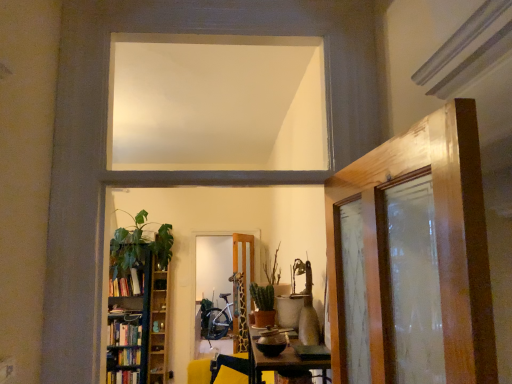
Question: From the image's perspective, is yellow fabric swivel chair at center over green matte plant at center, the 2th plant viewed from the front?

Choices:
 (A) yes
 (B) no

Answer: (B)

Question: Is yellow fabric swivel chair at center wider than green matte plant at center, the 1th plant from the back?

Choices:
 (A) no
 (B) yes

Answer: (A)

Question: Is yellow fabric swivel chair at center shorter than green matte plant at center, the 2th plant viewed from the front?

Choices:
 (A) no
 (B) yes

Answer: (B)

Question: Is yellow fabric swivel chair at center positioned beyond the bounds of green matte plant at center, the 2th plant viewed from the front?

Choices:
 (A) yes
 (B) no

Answer: (A)

Question: Does yellow fabric swivel chair at center have a smaller size compared to green matte plant at center, the 1th plant from the back?

Choices:
 (A) no
 (B) yes

Answer: (A)

Question: Is yellow fabric swivel chair at center in front of or behind green leafy plant at left in the image?

Choices:
 (A) behind
 (B) front

Answer: (B)

Question: Based on their sizes in the image, would you say yellow fabric swivel chair at center is bigger or smaller than green leafy plant at left?

Choices:
 (A) big
 (B) small

Answer: (B)

Question: From a real-world perspective, is yellow fabric swivel chair at center positioned above or below green leafy plant at left?

Choices:
 (A) above
 (B) below

Answer: (B)

Question: Considering the relative positions of yellow fabric swivel chair at center and green leafy plant at left in the image provided, is yellow fabric swivel chair at center to the left or to the right of green leafy plant at left?

Choices:
 (A) left
 (B) right

Answer: (B)

Question: Relative to green matte plant at center, the 2th plant viewed from the front, is white matte window at upper center in front or behind?

Choices:
 (A) behind
 (B) front

Answer: (B)

Question: From a real-world perspective, is white matte window at upper center physically located above or below green matte plant at center, the 1th plant from the back?

Choices:
 (A) above
 (B) below

Answer: (A)

Question: Is point (323, 94) positioned closer to the camera than point (261, 309)?

Choices:
 (A) closer
 (B) farther

Answer: (A)

Question: In terms of height, does white matte window at upper center look taller or shorter compared to green matte plant at center, the 2th plant viewed from the front?

Choices:
 (A) tall
 (B) short

Answer: (B)

Question: Is green matte plant at center, the 1th plant from the back, taller or shorter than hardcover books at left?

Choices:
 (A) tall
 (B) short

Answer: (A)

Question: In terms of size, does green matte plant at center, the 2th plant viewed from the front, appear bigger or smaller than hardcover books at left?

Choices:
 (A) small
 (B) big

Answer: (A)